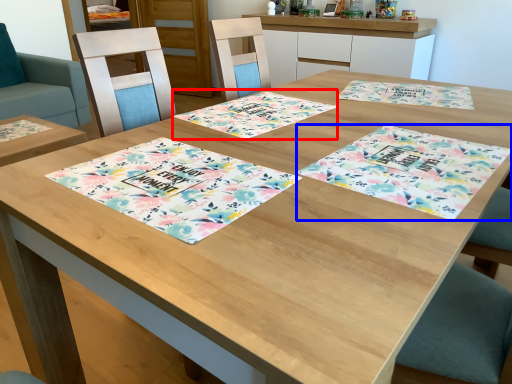
Question: Which object is closer to the camera taking this photo, place mat (highlighted by a red box) or place mat (highlighted by a blue box)?

Choices:
 (A) place mat
 (B) place mat

Answer: (B)